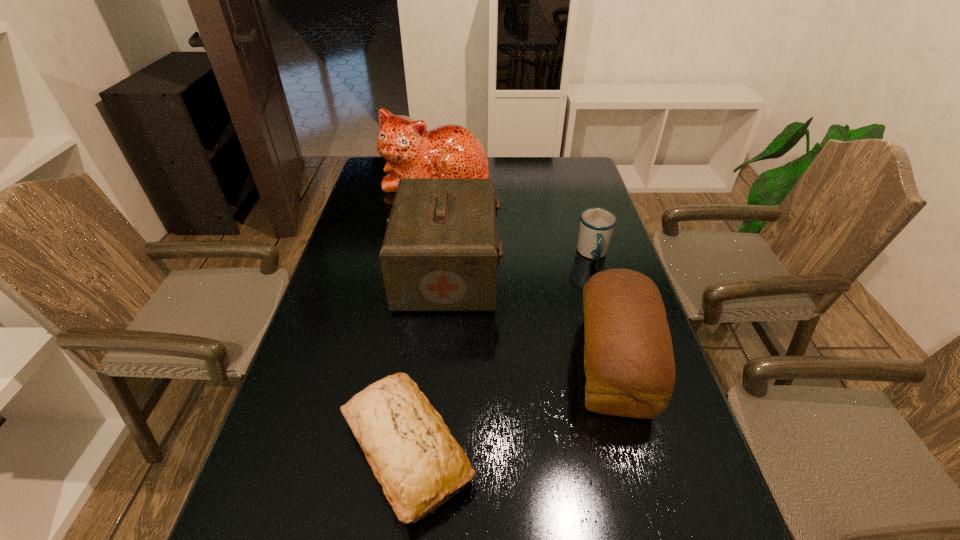
Find the location of a particular element. the farthest object is located at coordinates (449, 151).

Locate an element on the screen. the first-aid kit is located at coordinates (440, 252).

This screenshot has width=960, height=540. Identify the location of the taller bread. (629, 363).

Identify the location of the third tallest object. The width and height of the screenshot is (960, 540). (629, 363).

This screenshot has width=960, height=540. I want to click on mug, so click(x=596, y=224).

I want to click on the left bread, so click(413, 455).

What are the coordinates of `free space located 0.370m on the face of the cat` in the screenshot? It's located at (422, 269).

Identify the location of vacant region located on the front of the first-aid kit. This screenshot has height=540, width=960. (438, 389).

Identify the location of vacant space located 0.350m on the left of the third shortest object. This screenshot has height=540, width=960. (420, 364).

Identify the location of vacant space located 0.210m on the handle side of the mug. (613, 323).